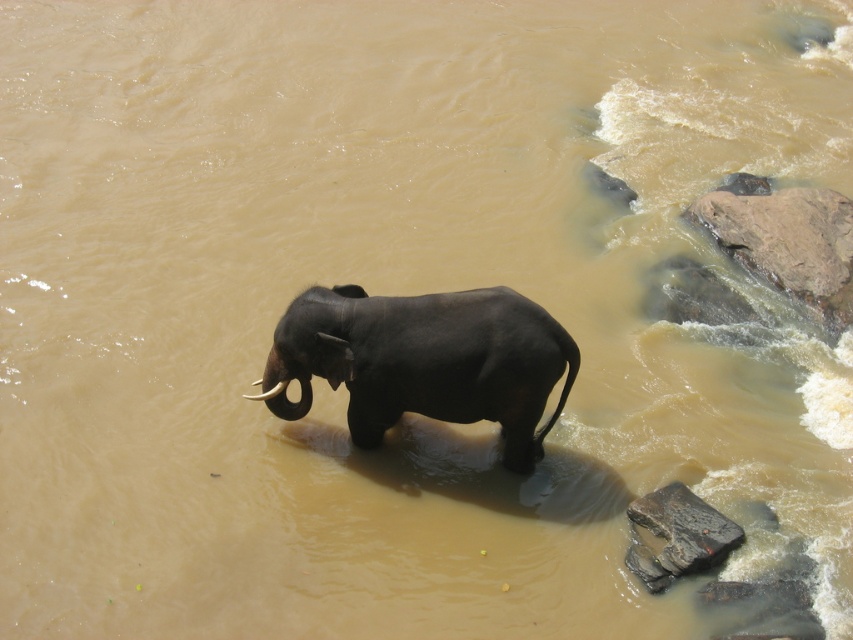
Does shiny black elephant at center have a larger size compared to white ivory tusk at center?

Yes.

Does point (463, 349) come in front of point (260, 380)?

That is True.

The image size is (853, 640). I want to click on shiny black elephant at center, so click(x=425, y=360).

Can you confirm if shiny black elephant at center is positioned to the right of white ivory tusk at upper center?

Correct, you'll find shiny black elephant at center to the right of white ivory tusk at upper center.

In the scene shown: Is shiny black elephant at center smaller than white ivory tusk at upper center?

No.

From the picture: Who is more distant from viewer, (337, 376) or (257, 381)?

Point (257, 381)

The height and width of the screenshot is (640, 853). Identify the location of shiny black elephant at center. (425, 360).

Is white ivory tusk at center above white ivory tusk at upper center?

Incorrect, white ivory tusk at center is not positioned above white ivory tusk at upper center.

Is white ivory tusk at center wider than white ivory tusk at upper center?

Yes.

Does point (283, 384) come closer to viewer compared to point (251, 381)?

Yes, point (283, 384) is closer to viewer.

Find the location of a particular element. white ivory tusk at center is located at coordinates (267, 392).